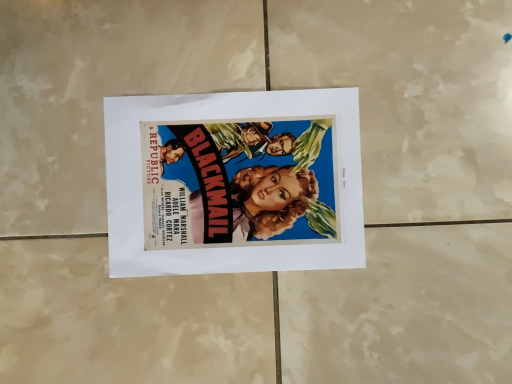
The width and height of the screenshot is (512, 384). In order to click on blank space above matte paper poster at center (from a real-world perspective) in this screenshot , I will do `click(229, 179)`.